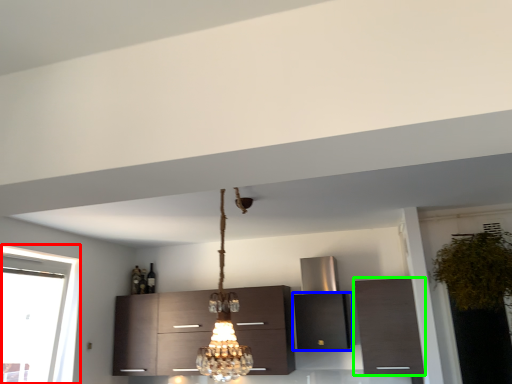
Question: Which object is the farthest from window (highlighted by a red box)? Choose among these: cabinetry (highlighted by a blue box) or cabinetry (highlighted by a green box).

Choices:
 (A) cabinetry
 (B) cabinetry

Answer: (B)